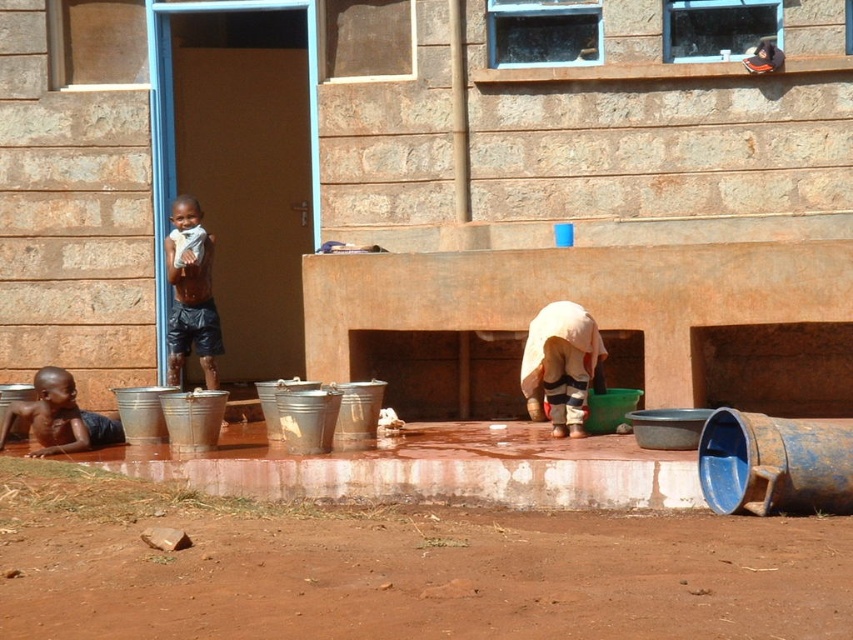
You are a painter who needs to set up an easel to paint the brown stone wall at center and the blue rusty barrel at lower right. Given that the easel must be placed at a distance where both objects are fully visible without obstruction, which object should you position the easel closer to?

The easel should be positioned closer to the blue rusty barrel at lower right because the brown stone wall at center is taller and would require a closer vantage point to capture its full height without obstruction.

You are a delivery person approaching the building and need to leave a package at the doorstep. The dark brown shorts at left and the brown stone wall at center are in your path. Which object should you move around to reach the door without stepping on the wet area?

You should move around the dark brown shorts at left because the brown stone wall at center is on the right side of the dark brown shorts at left, so going around the shorts would avoid the wet area near the buckets.